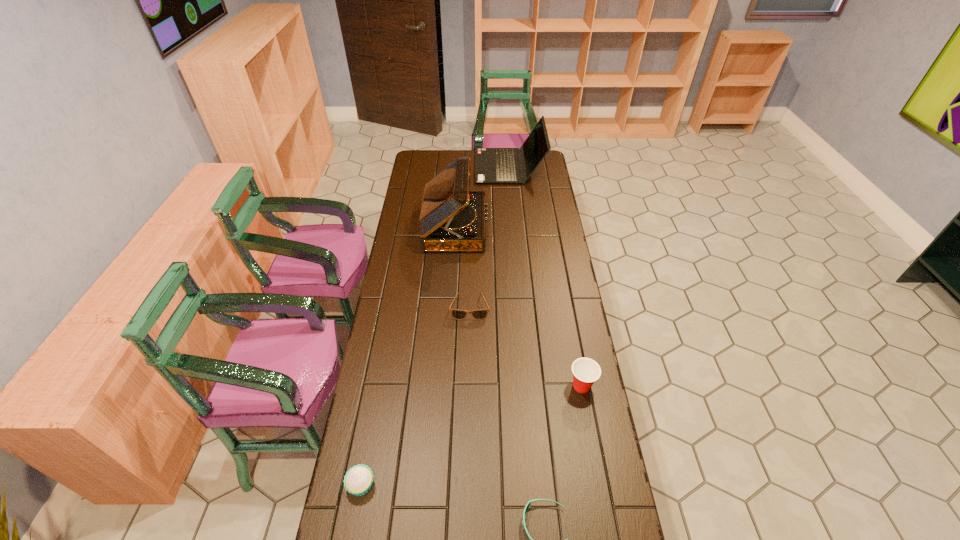
Image resolution: width=960 pixels, height=540 pixels. Identify the location of vacant region between the record player and the fifth farthest object. (408, 356).

Select which object is the third closest to the farthest object. Please provide its 2D coordinates. Your answer should be formatted as a tuple, i.e. [(x, y)], where the tuple contains the x and y coordinates of a point satisfying the conditions above.

[(586, 371)]

This screenshot has width=960, height=540. In order to click on object that is the fifth closest to the third nearest object in this screenshot , I will do `click(492, 165)`.

Identify the location of vacant position in the image that satisfies the following two spatial constraints: 1. on the front-facing side of the record player; 2. on the back side of the third nearest object. (444, 386).

Where is `free location that satisfies the following two spatial constraints: 1. on the front-facing side of the third nearest object; 2. on the left side of the second farthest object`? The height and width of the screenshot is (540, 960). free location that satisfies the following two spatial constraints: 1. on the front-facing side of the third nearest object; 2. on the left side of the second farthest object is located at coordinates (444, 386).

Identify the location of vacant area in the image that satisfies the following two spatial constraints: 1. on the frames of the third nearest object; 2. on the right side of the farther sunglasses. The height and width of the screenshot is (540, 960). (468, 386).

Identify the location of free spot that satisfies the following two spatial constraints: 1. on the screen of the fifth shortest object; 2. on the front side of the cupcake. (537, 485).